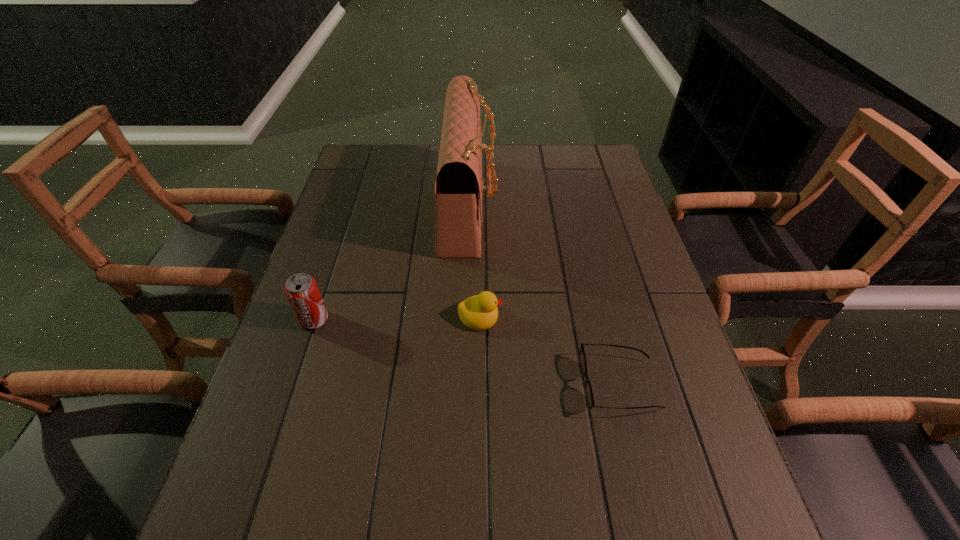
Locate an element on the screen. the tallest object is located at coordinates (459, 188).

Locate an element on the screen. The image size is (960, 540). handbag is located at coordinates (459, 188).

The height and width of the screenshot is (540, 960). Find the location of `the leftmost object`. the leftmost object is located at coordinates (301, 290).

This screenshot has height=540, width=960. In order to click on soda can in this screenshot , I will do `click(301, 290)`.

Where is `the third tallest object`? the third tallest object is located at coordinates (479, 312).

At what (x,y) coordinates should I click in order to perform the action: click on the shortest object. Please return your answer as a coordinate pair (x, y). Looking at the image, I should click on point(589,397).

The image size is (960, 540). What are the coordinates of `the rightmost object` in the screenshot? It's located at click(589, 397).

Locate an element on the screen. The width and height of the screenshot is (960, 540). vacant space located on the front-facing side of the handbag is located at coordinates (601, 205).

At what (x,y) coordinates should I click in order to perform the action: click on vacant space located on the front of the third shortest object. Please return your answer as a coordinate pair (x, y). This screenshot has height=540, width=960. Looking at the image, I should click on (249, 517).

This screenshot has width=960, height=540. Identify the location of free location located 0.120m on the face of the duckling. (552, 316).